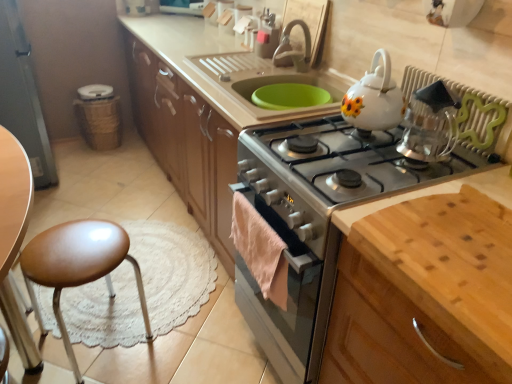
Question: Is clear glass kettle at upper right turned away from green plastic radiator at upper right?

Choices:
 (A) no
 (B) yes

Answer: (B)

Question: Is clear glass kettle at upper right aimed at green plastic radiator at upper right?

Choices:
 (A) no
 (B) yes

Answer: (A)

Question: From the image's perspective, does clear glass kettle at upper right appear higher than green plastic radiator at upper right?

Choices:
 (A) no
 (B) yes

Answer: (A)

Question: Is clear glass kettle at upper right thinner than green plastic radiator at upper right?

Choices:
 (A) no
 (B) yes

Answer: (A)

Question: Can you confirm if clear glass kettle at upper right is bigger than green plastic radiator at upper right?

Choices:
 (A) no
 (B) yes

Answer: (B)

Question: Is clear glass kettle at upper right not close to green plastic radiator at upper right?

Choices:
 (A) yes
 (B) no

Answer: (B)

Question: Does silver metallic gas stove at center have a lesser width compared to white glossy teapot at upper right?

Choices:
 (A) yes
 (B) no

Answer: (B)

Question: From the image's perspective, is silver metallic gas stove at center located above white glossy teapot at upper right?

Choices:
 (A) no
 (B) yes

Answer: (A)

Question: Can white glossy teapot at upper right be found inside silver metallic gas stove at center?

Choices:
 (A) yes
 (B) no

Answer: (B)

Question: Is white glossy teapot at upper right at the back of silver metallic gas stove at center?

Choices:
 (A) yes
 (B) no

Answer: (B)

Question: From the image's perspective, is silver metallic gas stove at center beneath white glossy teapot at upper right?

Choices:
 (A) no
 (B) yes

Answer: (B)

Question: Would you say silver metallic gas stove at center is a long distance from white glossy teapot at upper right?

Choices:
 (A) no
 (B) yes

Answer: (A)

Question: Is silver metallic gas stove at center thinner than light brown wood cutting board at lower right?

Choices:
 (A) yes
 (B) no

Answer: (B)